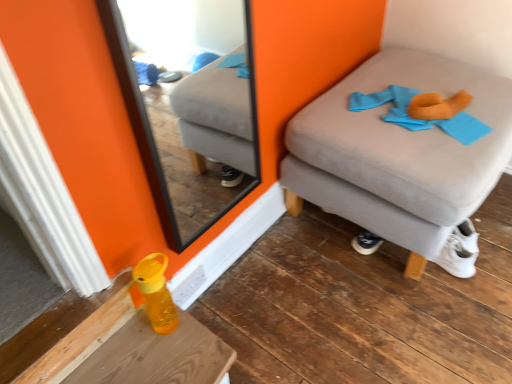
Where is `vacant area that lies in front of blue fabric at upper right`? The image size is (512, 384). vacant area that lies in front of blue fabric at upper right is located at coordinates (424, 164).